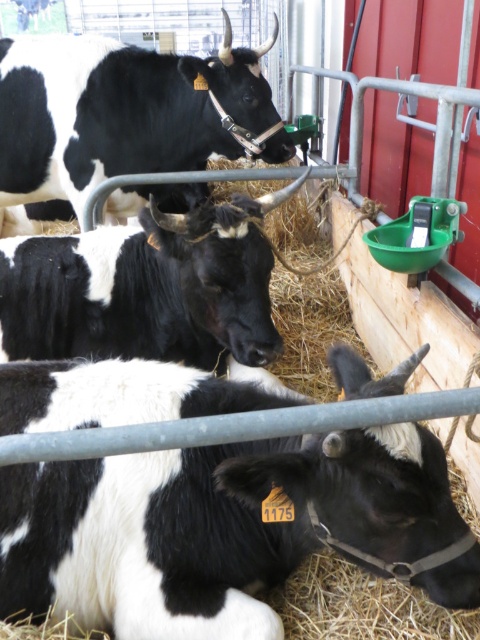
You are standing in the barn and need to reach the green plastic feeder attached to the red wall. There are two cows in your way. Which cow should you move first to get to the feeder? The cows are the black and white fur at lower left and the black matte cow at center.

You should move the black and white fur at lower left first because it is closer to you than the black matte cow at center, so it is blocking your path more directly.

You are a farmer checking the feeding area. You notice the black and white fur at lower left and the black matte cow at center. Which cow requires more feed based on their sizes?

The black matte cow at center requires more feed since it is larger than the black and white fur at lower left.

You are standing in the barn and want to place a new feeding station. You have two points marked on the barn wall where you can attach it. The points are labeled as point (211, 522) and point (255, 60). Which point is closer to you so that the feeding station will be more accessible?

Point (211, 522) is closer to the camera than point (255, 60), so the feeding station attached to point (211, 522) will be more accessible.